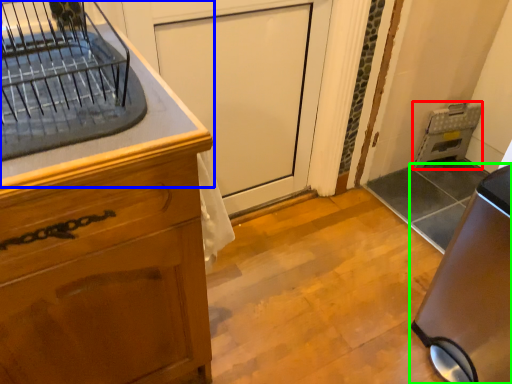
Question: Estimate the real-world distances between objects in this image. Which object is closer to appliance (highlighted by a red box), countertop (highlighted by a blue box) or home appliance (highlighted by a green box)?

Choices:
 (A) countertop
 (B) home appliance

Answer: (B)